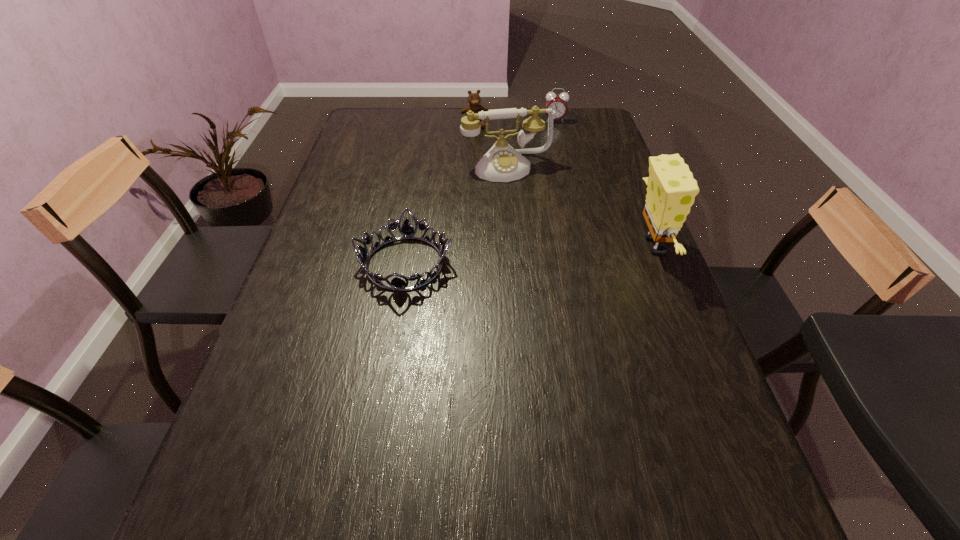
Where is `tiara`? The height and width of the screenshot is (540, 960). tiara is located at coordinates (407, 231).

This screenshot has width=960, height=540. I want to click on the tallest object, so click(x=671, y=191).

The width and height of the screenshot is (960, 540). Find the location of `the rightmost object`. the rightmost object is located at coordinates (x=671, y=191).

The image size is (960, 540). What are the coordinates of `teddy bear` in the screenshot? It's located at (474, 99).

Where is `the third farthest object`? The image size is (960, 540). the third farthest object is located at coordinates click(502, 163).

Identify the location of telephone. (502, 163).

Identify the location of alarm clock. (558, 103).

This screenshot has height=540, width=960. Find the location of `free spot located 0.330m on the front-facing side of the shortest object`. free spot located 0.330m on the front-facing side of the shortest object is located at coordinates (375, 437).

What are the coordinates of `vacant area situated at the face of the teddy bear` in the screenshot? It's located at (494, 182).

At what (x,y) coordinates should I click in order to perform the action: click on vacant area situated at the face of the teddy bear. Please return your answer as a coordinate pair (x, y). Looking at the image, I should click on (485, 153).